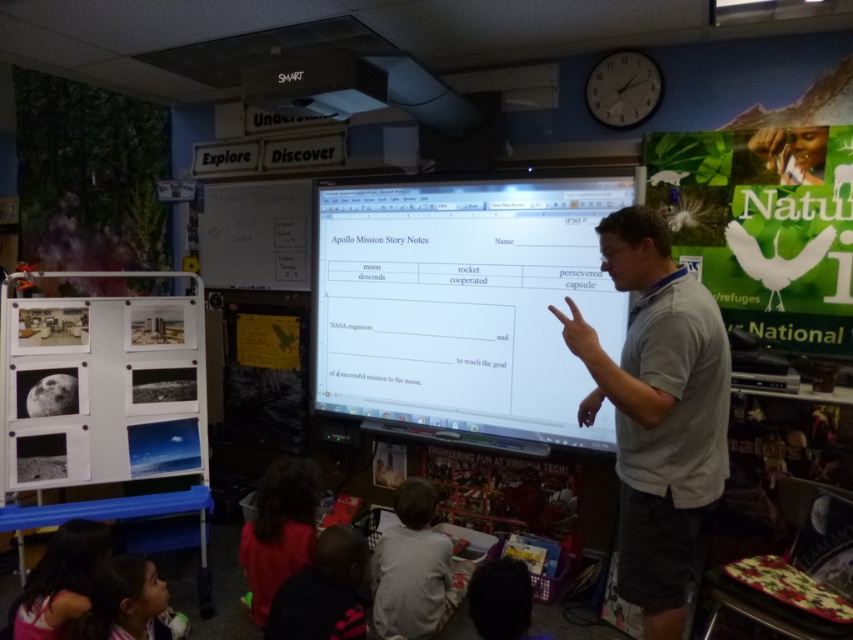
You are a student sitting in the classroom and want to hand in a paper to the teacher. You see the red fabric shirt at lower left and the dark blue sweater at lower left. Which one is closer to you?

The red fabric shirt at lower left is closer to you because the dark blue sweater at lower left is behind it.

You are a student sitting at the back of the classroom. You want to look at both the green paper poster at right and the dark blue sweater at lower left. Which object will you need to look at first to avoid having to turn your head?

The green paper poster at right is closer to you than the dark blue sweater at lower left, so you should look at the green paper poster at right first to avoid turning your head.

You are a student sitting at the back of the classroom and want to know which clothing item is wider between the red fabric shirt at lower left and the dark blue sweater at lower left. Can you determine which one is wider?

The red fabric shirt at lower left is wider than the dark blue sweater at lower left according to the description provided.